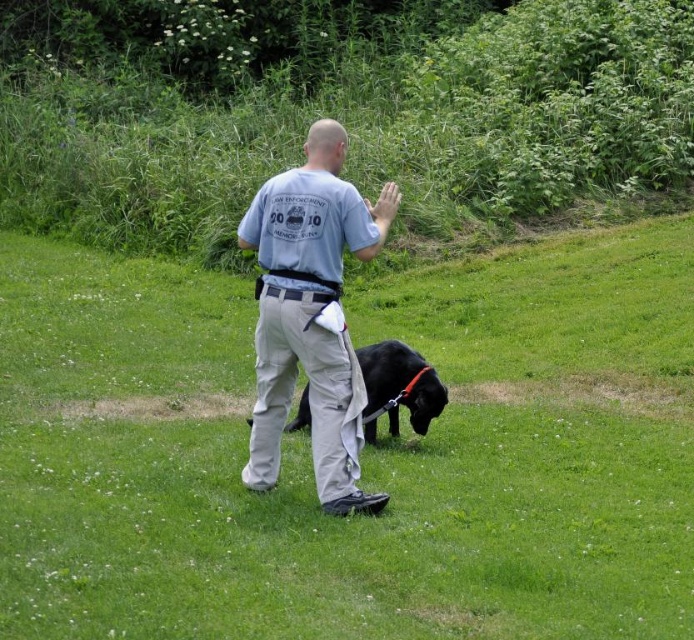
You are a photographer trying to capture the black matte dog at center and the black leather belt at center in a single shot. Which object should you focus on first to ensure both are in focus?

The black matte dog at center is further to the viewer than the black leather belt at center, so you should focus on the black matte dog at center first to ensure both are in focus.

You are standing at the center of the image. Where is the green grass at center located?

The green grass at center is located at point [362,452].

Consider the image. You are standing at the origin point in the image. The black matte dog at center is located at point (398, 387). If you want to walk directly to the black matte dog at center, in which direction should you move?

The black matte dog at center is located at point (398, 387), so you should move in the direction of increasing x and y coordinates to reach it.